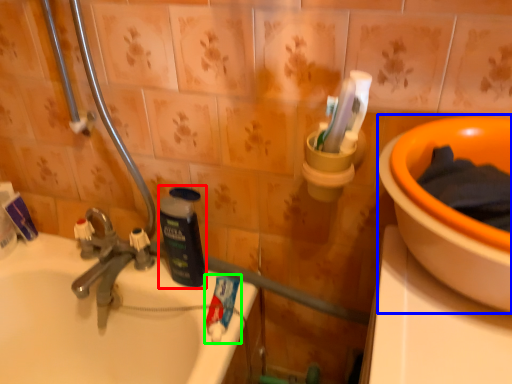
Question: Based on their relative distances, which object is nearer to bottle (highlighted by a red box)? Choose from basin (highlighted by a blue box) and toothpaste (highlighted by a green box).

Choices:
 (A) basin
 (B) toothpaste

Answer: (B)